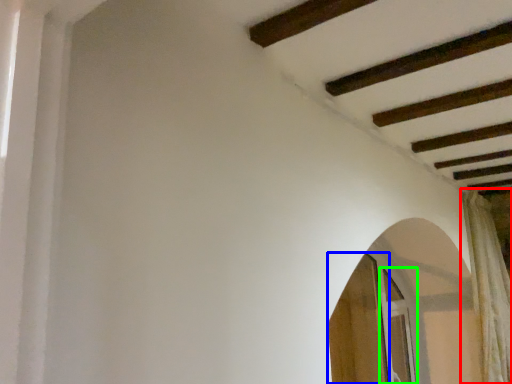
Question: Estimate the real-world distances between objects in this image. Which object is farther from curtain (highlighted by a red box), screen door (highlighted by a blue box) or screen door (highlighted by a green box)?

Choices:
 (A) screen door
 (B) screen door

Answer: (A)